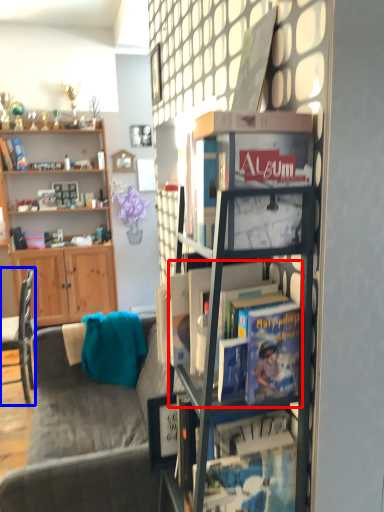
Question: Which object is closer to the camera taking this photo, book (highlighted by a red box) or chair (highlighted by a blue box)?

Choices:
 (A) book
 (B) chair

Answer: (A)